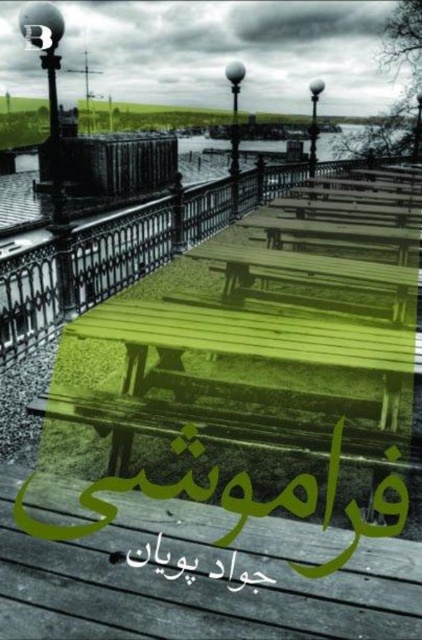
Between point (302, 168) and point (419, 97), which one is positioned in front?

Point (302, 168)

Can you confirm if green painted wood rail at center is positioned above metallic lamp post at upper center?

Incorrect, green painted wood rail at center is not positioned above metallic lamp post at upper center.

Between point (194, 221) and point (414, 156), which one is positioned in front?

Point (194, 221) is more forward.

Locate an element on the screen. green painted wood rail at center is located at coordinates (143, 237).

Can you confirm if black paper at center is bigger than metallic lamp post at upper center?

Incorrect, black paper at center is not larger than metallic lamp post at upper center.

Which is below, black paper at center or metallic lamp post at upper center?

black paper at center

Between point (164, 566) and point (419, 115), which one is positioned behind?

Point (419, 115)

The image size is (422, 640). Find the location of `black paper at center`. black paper at center is located at coordinates (194, 566).

Can you confirm if polished metal lamp post at upper left is wider than polished metal lamp post at upper center?

Correct, the width of polished metal lamp post at upper left exceeds that of polished metal lamp post at upper center.

Find the location of `polished metal lamp post at upper left`. polished metal lamp post at upper left is located at coordinates (53, 138).

What are the coordinates of `polished metal lamp post at upper left` in the screenshot? It's located at (53, 138).